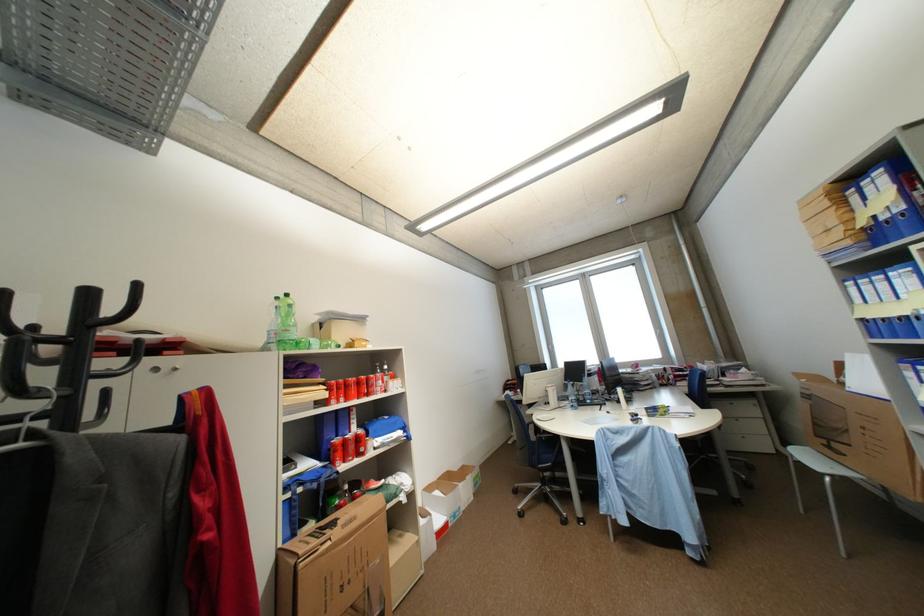
Where would you rest the chair armrest? Please return your answer as a coordinate pair (x, y).

(545, 436)